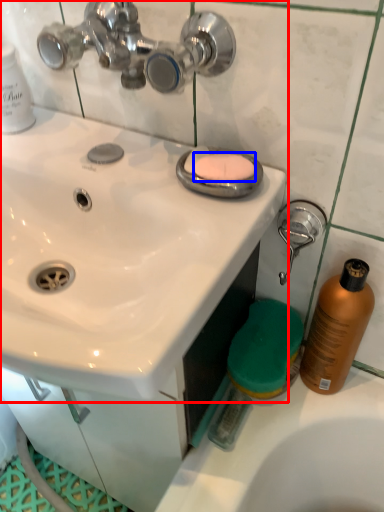
Question: Among these objects, which one is nearest to the camera, sink (highlighted by a red box) or soap (highlighted by a blue box)?

Choices:
 (A) sink
 (B) soap

Answer: (A)